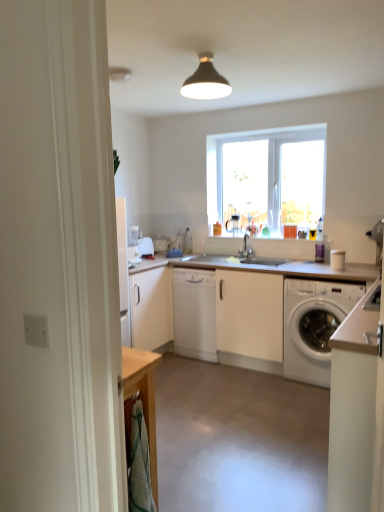
Question: Can you confirm if white matte cabinet at lower right, arranged as the 1th cabinetry when viewed from the right, is positioned to the left of transparent glass window at center?

Choices:
 (A) no
 (B) yes

Answer: (A)

Question: Is white matte cabinet at lower right, which appears as the first cabinetry when viewed from the front, outside transparent glass window at center?

Choices:
 (A) yes
 (B) no

Answer: (A)

Question: Is white matte cabinet at lower right, which is counted as the second cabinetry, starting from the back, to the right of transparent glass window at center from the viewer's perspective?

Choices:
 (A) no
 (B) yes

Answer: (B)

Question: Is the depth of white matte cabinet at lower right, arranged as the 1th cabinetry when viewed from the right, greater than that of transparent glass window at center?

Choices:
 (A) yes
 (B) no

Answer: (B)

Question: Can you confirm if white matte cabinet at lower right, which appears as the first cabinetry when viewed from the front, is shorter than transparent glass window at center?

Choices:
 (A) no
 (B) yes

Answer: (B)

Question: From the image's perspective, is white matte cabinet at lower right, the second cabinetry in the left-to-right sequence, located above transparent glass window at center?

Choices:
 (A) yes
 (B) no

Answer: (B)

Question: Is white matte cabinet at lower right, which appears as the first cabinetry when viewed from the front, shorter than white matte countertop at center?

Choices:
 (A) yes
 (B) no

Answer: (B)

Question: Is white matte cabinet at lower right, the second cabinetry in the left-to-right sequence, positioned before white matte countertop at center?

Choices:
 (A) no
 (B) yes

Answer: (B)

Question: From the image's perspective, is white matte cabinet at lower right, arranged as the 1th cabinetry when viewed from the right, on top of white matte countertop at center?

Choices:
 (A) yes
 (B) no

Answer: (B)

Question: From a real-world perspective, is white matte cabinet at lower right, the second cabinetry in the left-to-right sequence, under white matte countertop at center?

Choices:
 (A) no
 (B) yes

Answer: (B)

Question: Considering the relative sizes of white matte cabinet at lower right, which is counted as the second cabinetry, starting from the back, and white matte countertop at center in the image provided, is white matte cabinet at lower right, which is counted as the second cabinetry, starting from the back, smaller than white matte countertop at center?

Choices:
 (A) no
 (B) yes

Answer: (B)

Question: Would you say white matte cabinet at lower right, the second cabinetry in the left-to-right sequence, is outside white matte countertop at center?

Choices:
 (A) yes
 (B) no

Answer: (A)

Question: Does white matte cabinet at center, which is counted as the second cabinetry, starting from the right, appear on the left side of white matte countertop at center?

Choices:
 (A) yes
 (B) no

Answer: (A)